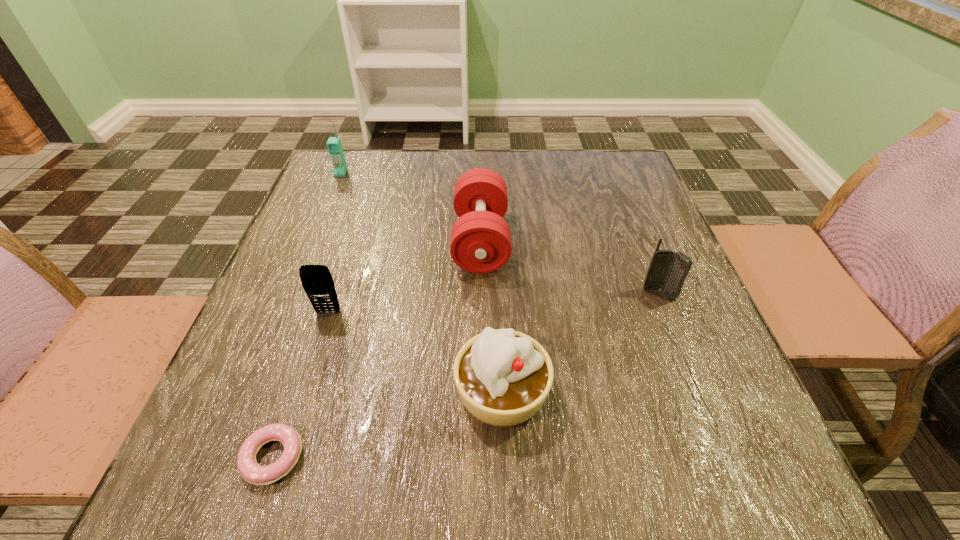
Identify the location of free space that satisfies the following two spatial constraints: 1. on the back side of the shortest object; 2. on the left side of the dumbbell. (345, 241).